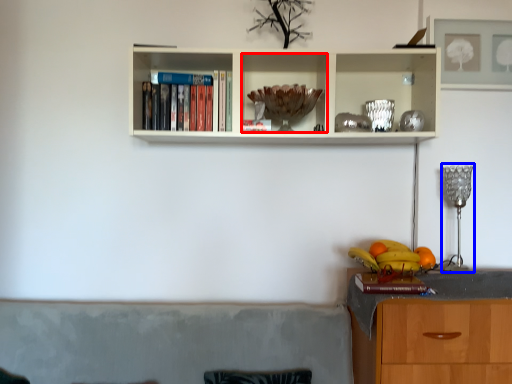
Question: Which object appears closest to the camera in this image, cabinet (highlighted by a red box) or lamp (highlighted by a blue box)?

Choices:
 (A) cabinet
 (B) lamp

Answer: (A)